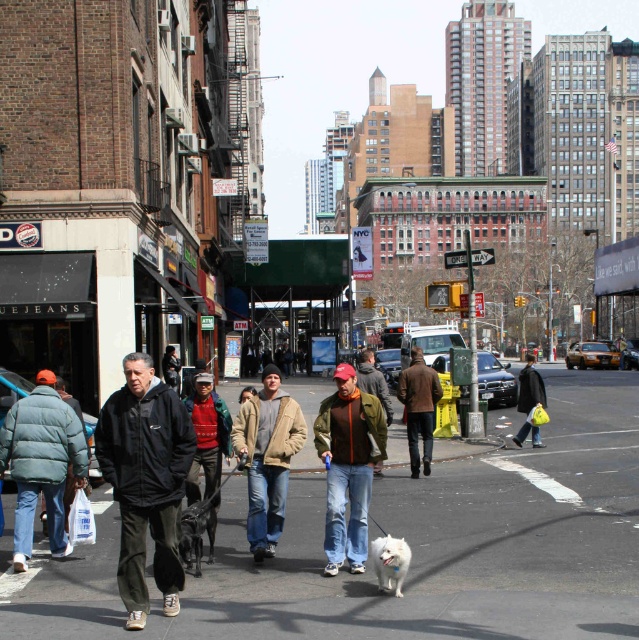
You are a street vendor who wants to place a small sign between the black matte jacket at center and the tan fleece jacket at center. Which jacket should you place the sign closer to to ensure it fits within the narrower space?

The black matte jacket at center has a lesser width compared to the tan fleece jacket at center, so you should place the sign closer to the black matte jacket at center to fit within the narrower space.

You are a tailor observing the pedestrians in the urban street scene. You need to determine which jacket, the green matte jacket at center or the tan fleece jacket at center, would require more fabric to make. Based on the description provided, which one would you choose?

The tan fleece jacket at center requires more fabric because it has a larger size than the green matte jacket at center.